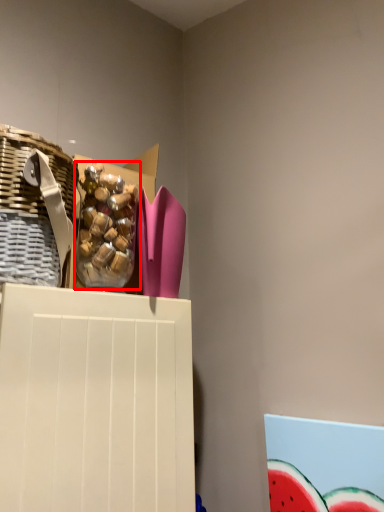
Question: From the image, what is the correct spatial relationship of food (annotated by the red box) in relation to basket?

Choices:
 (A) right
 (B) left

Answer: (A)